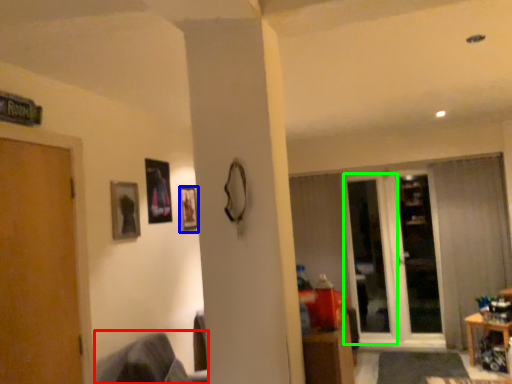
Question: Which is nearer to the swivel chair (highlighted by a red box)? picture frame (highlighted by a blue box) or screen door (highlighted by a green box).

Choices:
 (A) picture frame
 (B) screen door

Answer: (A)